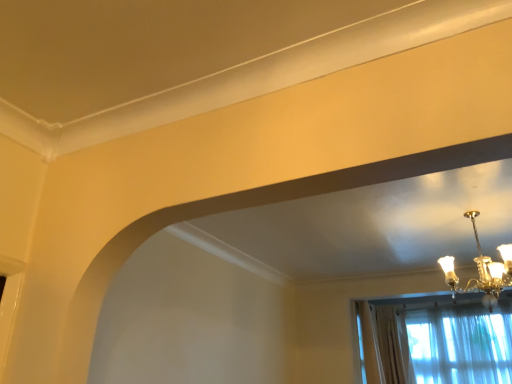
You are a GUI agent. You are given a task and a screenshot of the screen. Output one action in this format:
    pyautogui.click(x=<x>, y=<y>)
    Task: Click on the gold metallic chandelier at upper right
    
    Given the screenshot: What is the action you would take?
    pyautogui.click(x=482, y=271)

Describe the element at coordinates (482, 271) in the screenshot. The height and width of the screenshot is (384, 512). I see `gold metallic chandelier at upper right` at that location.

Image resolution: width=512 pixels, height=384 pixels. I want to click on gold metallic chandelier at upper right, so click(482, 271).